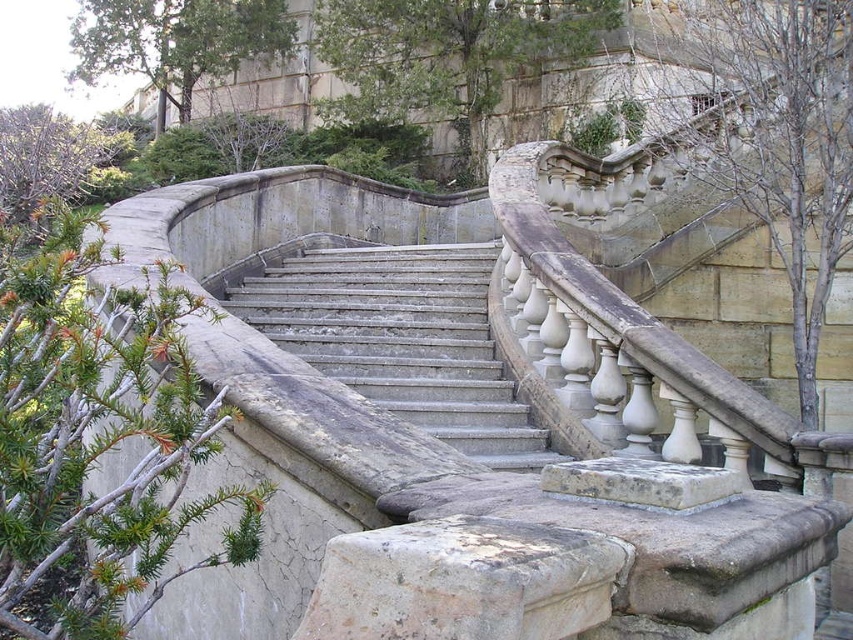
Question: Which of these objects is positioned farthest from the green leafy tree at upper left?

Choices:
 (A) green leafy tree at upper center
 (B) green leafy bush at upper left
 (C) green leafy bush at left
 (D) gray stone stairs at center

Answer: (C)

Question: In this image, where is green leafy bush at left located relative to bare wood tree at upper right?

Choices:
 (A) right
 (B) left

Answer: (B)

Question: Can you confirm if green leafy tree at upper center is positioned to the right of green leafy tree at upper left?

Choices:
 (A) yes
 (B) no

Answer: (A)

Question: Estimate the real-world distances between objects in this image. Which object is closer to the gray stone stairs at center?

Choices:
 (A) green leafy bush at upper left
 (B) green leafy tree at upper left

Answer: (A)

Question: Which of these objects is positioned farthest from the green leafy tree at upper center?

Choices:
 (A) green leafy tree at upper left
 (B) green leafy bush at left
 (C) gray stone stairs at center
 (D) green leafy bush at upper left

Answer: (B)

Question: Can you confirm if gray stone stairs at center is positioned to the left of green leafy bush at upper left?

Choices:
 (A) no
 (B) yes

Answer: (A)